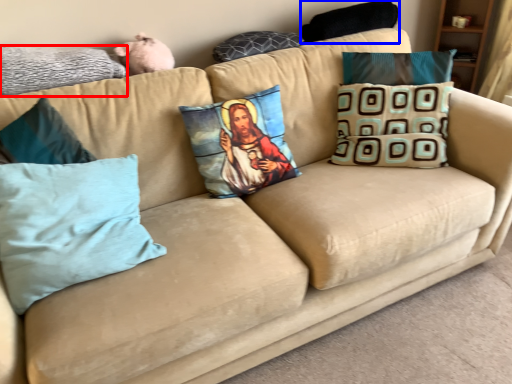
Question: Among these objects, which one is nearest to the camera, pillow (highlighted by a red box) or pillow (highlighted by a blue box)?

Choices:
 (A) pillow
 (B) pillow

Answer: (A)